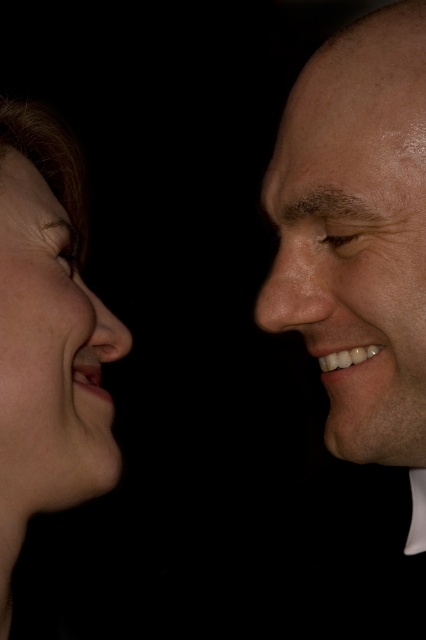
Does smooth skin face at right have a greater width compared to smooth skin nose at center?

Indeed, smooth skin face at right has a greater width compared to smooth skin nose at center.

Between point (336, 68) and point (296, 292), which one is positioned in front?

Point (336, 68) is more forward.

At what (x,y) coordinates should I click in order to perform the action: click on smooth skin face at right. Please return your answer as a coordinate pair (x, y). The image size is (426, 640). Looking at the image, I should click on (362, 260).

Is smooth skin face at right wider than shiny skin forehead at upper right?

Correct, the width of smooth skin face at right exceeds that of shiny skin forehead at upper right.

Between point (264, 310) and point (282, 131), which one is positioned behind?

Point (282, 131)

You are a GUI agent. You are given a task and a screenshot of the screen. Output one action in this format:
    pyautogui.click(x=<x>, y=<y>)
    Task: Click on the smooth skin face at right
    This screenshot has width=426, height=640.
    Given the screenshot: What is the action you would take?
    pyautogui.click(x=362, y=260)

You are a GUI agent. You are given a task and a screenshot of the screen. Output one action in this format:
    pyautogui.click(x=<x>, y=<y>)
    Task: Click on the smooth skin face at right
    This screenshot has height=640, width=426.
    Given the screenshot: What is the action you would take?
    pyautogui.click(x=362, y=260)

Between matte skin face at left and smooth skin nose at center, which one has more height?

Standing taller between the two is matte skin face at left.

Which is in front, point (51, 492) or point (328, 234)?

Point (328, 234)

Does point (22, 166) come in front of point (288, 296)?

No, (22, 166) is further to viewer.

The height and width of the screenshot is (640, 426). In order to click on matte skin face at left in this screenshot , I will do `click(46, 339)`.